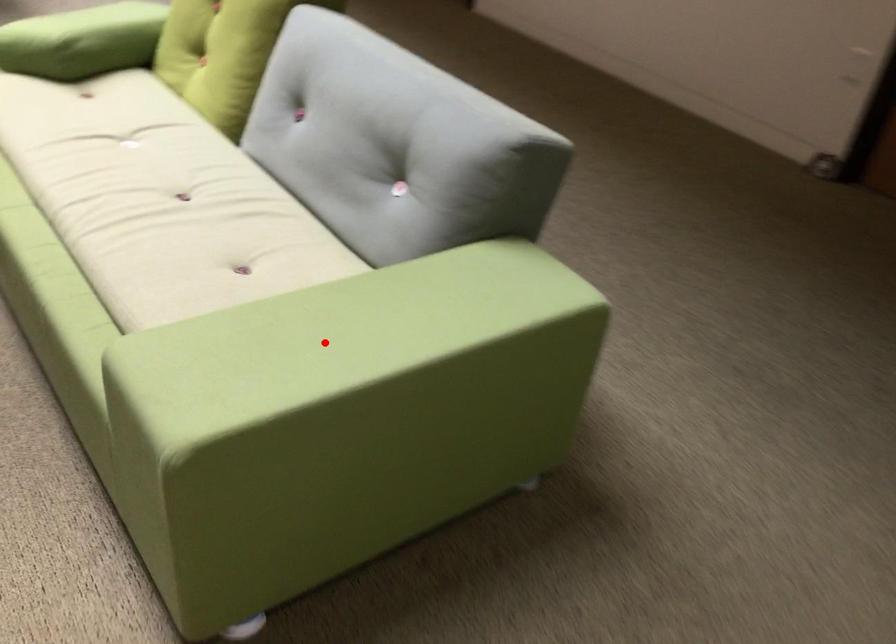
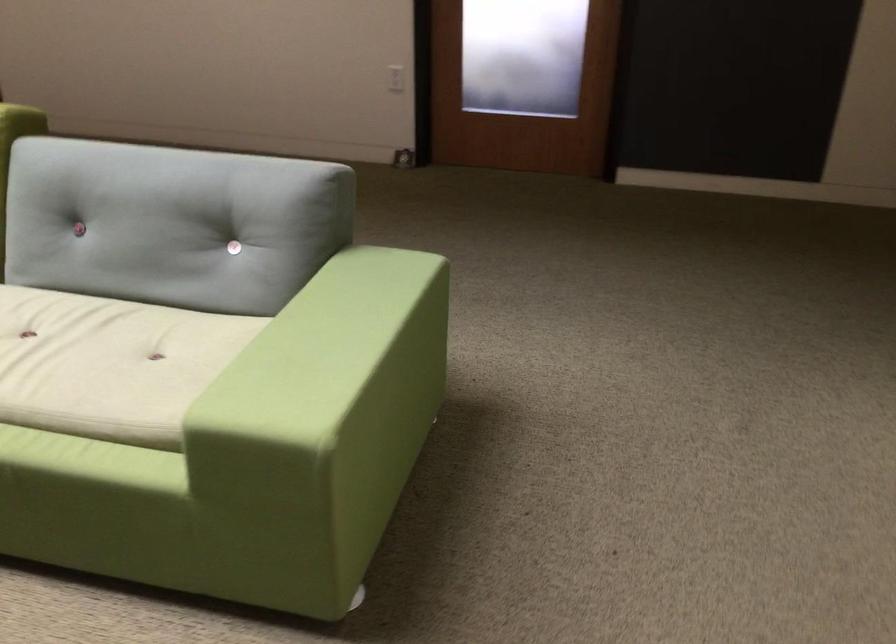
In the second image, find the point that corresponds to the highlighted location in the first image.

(323, 353)